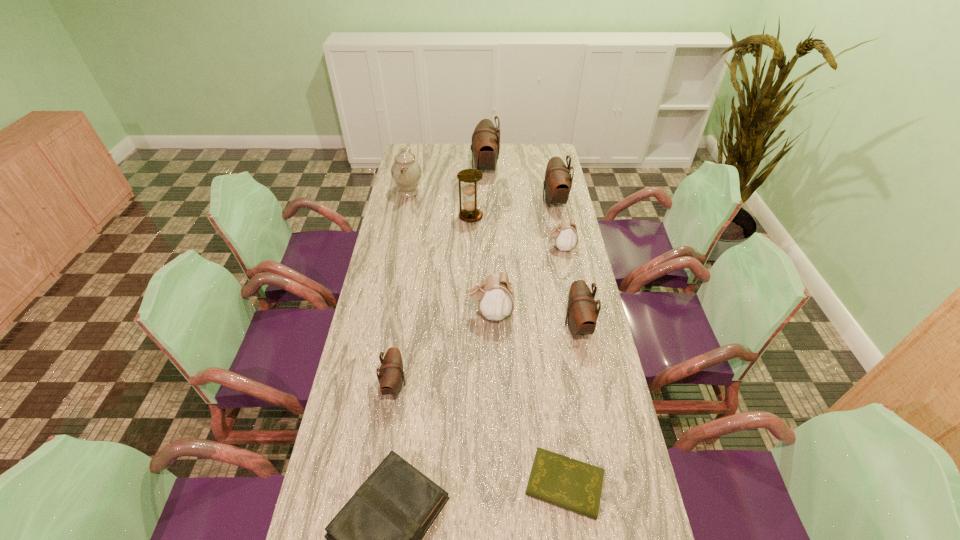
Identify the location of the farther white pouch. (565, 234).

Image resolution: width=960 pixels, height=540 pixels. Find the location of `the eighth farthest object`. the eighth farthest object is located at coordinates (391, 375).

Locate an element on the screen. The height and width of the screenshot is (540, 960). the leftmost brown pouch is located at coordinates (391, 375).

Where is `diary`? diary is located at coordinates (574, 485).

Image resolution: width=960 pixels, height=540 pixels. Identify the location of green diary. (574, 485).

Find the location of a particular element. free region located with the flap open on the biggest brown pouch is located at coordinates (437, 168).

Find the location of `vacant space situated with the flap open on the biggest brown pouch`. vacant space situated with the flap open on the biggest brown pouch is located at coordinates (413, 168).

The image size is (960, 540). I want to click on vacant space located 0.160m with the flap open on the biggest brown pouch, so click(439, 168).

This screenshot has width=960, height=540. I want to click on blank area located 0.200m on the spout of the chinaware, so click(467, 192).

Where is `vacant position located on the front of the brown hourglass`? The width and height of the screenshot is (960, 540). vacant position located on the front of the brown hourglass is located at coordinates (469, 255).